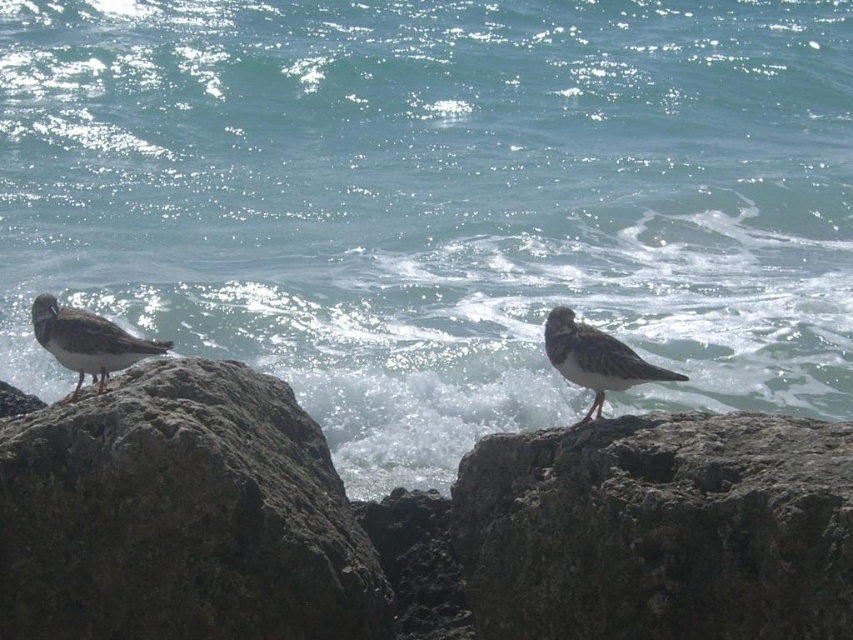
Question: Is gray rough rock at center closer to camera compared to gray matte bird at center?

Choices:
 (A) no
 (B) yes

Answer: (B)

Question: Can you confirm if speckled gray bird at left is positioned to the left of gray matte bird at center?

Choices:
 (A) no
 (B) yes

Answer: (B)

Question: Which is farther from the gray rough rock at left?

Choices:
 (A) speckled gray bird at left
 (B) rough textured rock at center
 (C) gray matte bird at center
 (D) gray rough rock at center

Answer: (C)

Question: Which of the following is the closest to the observer?

Choices:
 (A) speckled gray bird at left
 (B) gray rough rock at center
 (C) gray rough rock at left
 (D) rough textured rock at center

Answer: (D)

Question: Is gray rough rock at center positioned at the back of gray rough rock at left?

Choices:
 (A) yes
 (B) no

Answer: (A)

Question: Which object appears farthest from the camera in this image?

Choices:
 (A) rough textured rock at center
 (B) gray matte bird at center

Answer: (B)